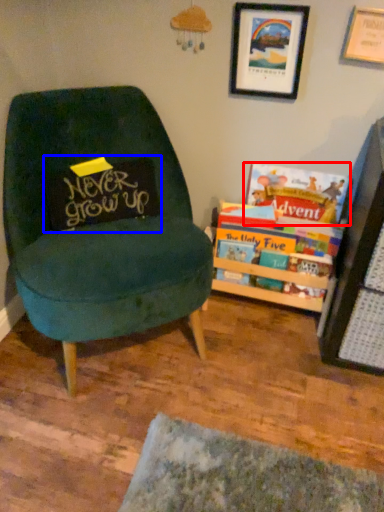
Question: Among these objects, which one is nearest to the camera, book (highlighted by a red box) or pillow (highlighted by a blue box)?

Choices:
 (A) book
 (B) pillow

Answer: (B)